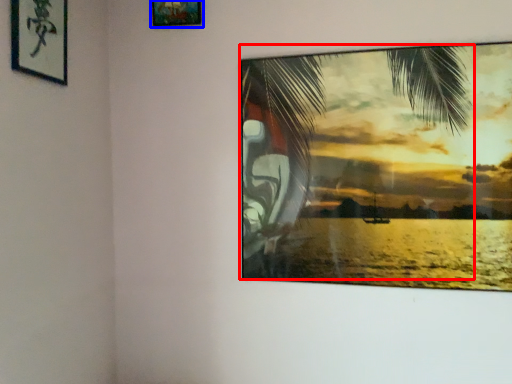
Question: Which point is closer to the camera, palm tree (highlighted by a red box) or picture frame (highlighted by a blue box)?

Choices:
 (A) palm tree
 (B) picture frame

Answer: (A)